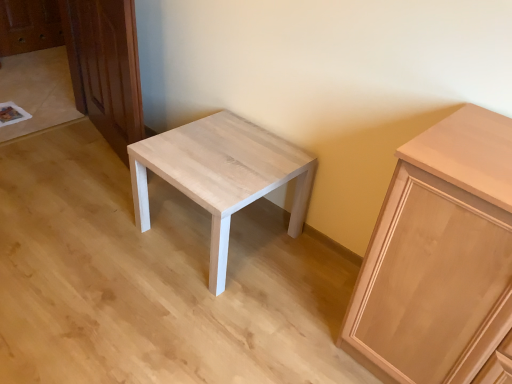
Locate an element on the screen. This screenshot has width=512, height=384. vacant space underneath light wood/texture stool at center (from a real-world perspective) is located at coordinates (231, 240).